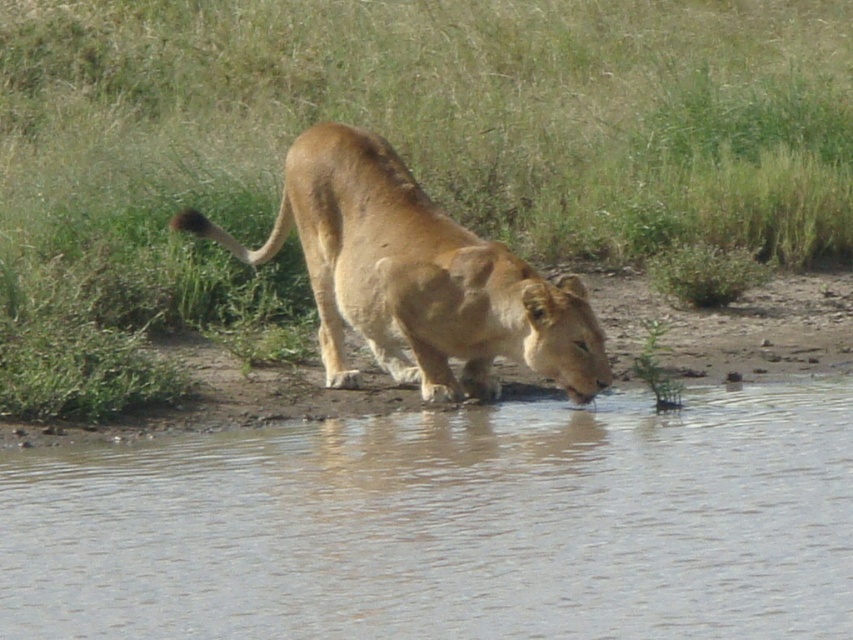
Question: Which point is closer to the camera?

Choices:
 (A) golden fur lion at center
 (B) clear water at lower center

Answer: (B)

Question: Which of the following is the farthest from the observer?

Choices:
 (A) (334, 342)
 (B) (834, 632)

Answer: (A)

Question: Is clear water at lower center further to the viewer compared to golden fur lion at center?

Choices:
 (A) no
 (B) yes

Answer: (A)

Question: Is clear water at lower center to the left of golden fur lion at center from the viewer's perspective?

Choices:
 (A) no
 (B) yes

Answer: (A)

Question: Which point is farther from the camera taking this photo?

Choices:
 (A) (685, 554)
 (B) (426, 276)

Answer: (B)

Question: Where is clear water at lower center located in relation to golden fur lion at center in the image?

Choices:
 (A) above
 (B) below

Answer: (B)